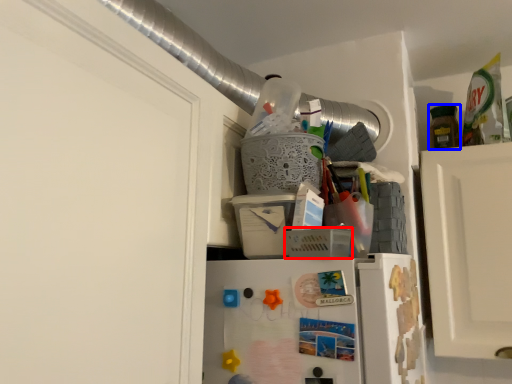
Question: Which of the following is the farthest to the observer, basket (highlighted by a red box) or bottle (highlighted by a blue box)?

Choices:
 (A) basket
 (B) bottle

Answer: (B)